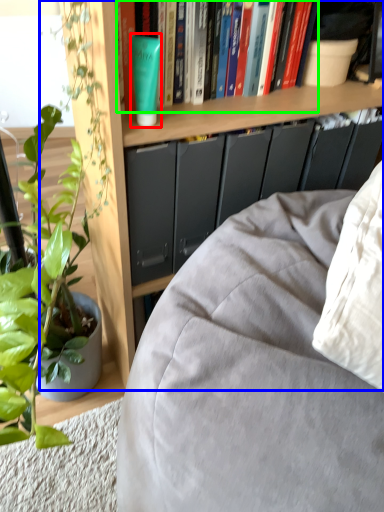
Question: Estimate the real-world distances between objects in this image. Which object is farther from paperback book (highlighted by a red box), bookcase (highlighted by a blue box) or book (highlighted by a green box)?

Choices:
 (A) bookcase
 (B) book

Answer: (A)